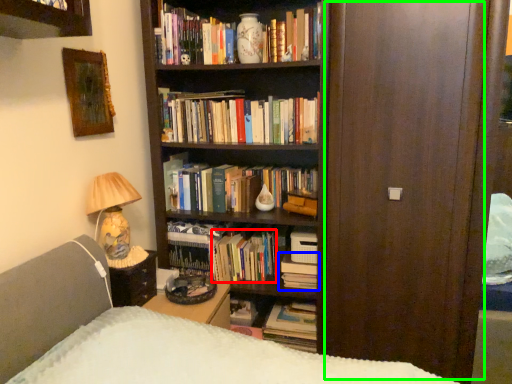
Question: Based on their relative distances, which object is farther from book (highlighted by a red box)? Choose from book (highlighted by a blue box) and glass door (highlighted by a green box).

Choices:
 (A) book
 (B) glass door

Answer: (B)